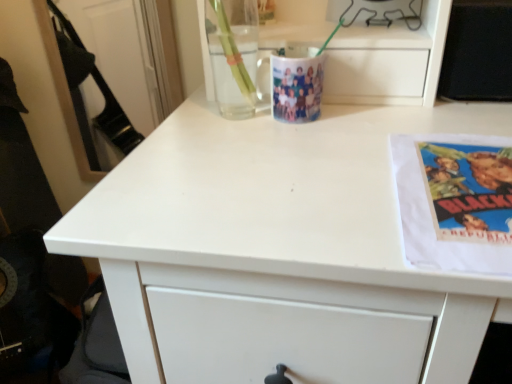
Question: Is white paper at right smaller than metallic wire at upper center?

Choices:
 (A) yes
 (B) no

Answer: (A)

Question: Can you confirm if white paper at right is taller than metallic wire at upper center?

Choices:
 (A) yes
 (B) no

Answer: (B)

Question: Could you tell me if white paper at right is turned towards metallic wire at upper center?

Choices:
 (A) no
 (B) yes

Answer: (A)

Question: Would you say metallic wire at upper center is part of white paper at right's contents?

Choices:
 (A) no
 (B) yes

Answer: (A)

Question: Is white paper at right outside of metallic wire at upper center?

Choices:
 (A) yes
 (B) no

Answer: (A)

Question: Is metallic wire at upper center taller or shorter than transparent glass mug at upper center?

Choices:
 (A) short
 (B) tall

Answer: (B)

Question: Relative to transparent glass mug at upper center, is metallic wire at upper center in front or behind?

Choices:
 (A) front
 (B) behind

Answer: (B)

Question: Which is correct: metallic wire at upper center is inside transparent glass mug at upper center, or outside of it?

Choices:
 (A) outside
 (B) inside

Answer: (A)

Question: From the image's perspective, relative to transparent glass mug at upper center, is metallic wire at upper center above or below?

Choices:
 (A) above
 (B) below

Answer: (A)

Question: From a real-world perspective, relative to metallic wire at upper center, is transparent glass mug at upper center vertically above or below?

Choices:
 (A) below
 (B) above

Answer: (A)

Question: Is transparent glass mug at upper center spatially inside metallic wire at upper center, or outside of it?

Choices:
 (A) outside
 (B) inside

Answer: (A)

Question: Considering the positions of transparent glass mug at upper center and metallic wire at upper center in the image, is transparent glass mug at upper center wider or thinner than metallic wire at upper center?

Choices:
 (A) thin
 (B) wide

Answer: (A)

Question: Is transparent glass mug at upper center to the left or to the right of metallic wire at upper center in the image?

Choices:
 (A) left
 (B) right

Answer: (A)

Question: In terms of size, does metallic wire at upper center appear bigger or smaller than white paper at right?

Choices:
 (A) small
 (B) big

Answer: (B)

Question: Do you think metallic wire at upper center is within white paper at right, or outside of it?

Choices:
 (A) outside
 (B) inside

Answer: (A)